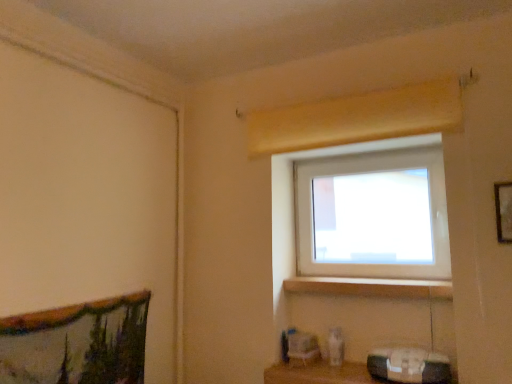
Question: Considering the relative positions of wooden at lower center and wooden picture frame at upper right in the image provided, is wooden at lower center to the right of wooden picture frame at upper right from the viewer's perspective?

Choices:
 (A) yes
 (B) no

Answer: (B)

Question: From the image's perspective, is wooden at lower center beneath wooden picture frame at upper right?

Choices:
 (A) yes
 (B) no

Answer: (A)

Question: From a real-world perspective, is wooden at lower center physically above wooden picture frame at upper right?

Choices:
 (A) no
 (B) yes

Answer: (A)

Question: Is wooden at lower center located outside wooden picture frame at upper right?

Choices:
 (A) yes
 (B) no

Answer: (A)

Question: Is wooden at lower center looking in the opposite direction of wooden picture frame at upper right?

Choices:
 (A) no
 (B) yes

Answer: (A)

Question: Is wooden at lower center next to wooden picture frame at upper right and touching it?

Choices:
 (A) yes
 (B) no

Answer: (B)

Question: Is white plastic window at upper center to the right of wooden picture frame at upper right from the viewer's perspective?

Choices:
 (A) yes
 (B) no

Answer: (B)

Question: Can we say white plastic window at upper center lies outside wooden picture frame at upper right?

Choices:
 (A) no
 (B) yes

Answer: (B)

Question: From the image's perspective, does white plastic window at upper center appear lower than wooden picture frame at upper right?

Choices:
 (A) no
 (B) yes

Answer: (B)

Question: Is wooden picture frame at upper right completely or partially inside white plastic window at upper center?

Choices:
 (A) yes
 (B) no

Answer: (B)

Question: Considering the relative sizes of white plastic window at upper center and wooden picture frame at upper right in the image provided, is white plastic window at upper center wider than wooden picture frame at upper right?

Choices:
 (A) yes
 (B) no

Answer: (A)

Question: Is white plastic window at upper center far away from wooden picture frame at upper right?

Choices:
 (A) no
 (B) yes

Answer: (A)

Question: From a real-world perspective, is wooden shelf at lower center located higher than white plastic window at upper center?

Choices:
 (A) no
 (B) yes

Answer: (A)